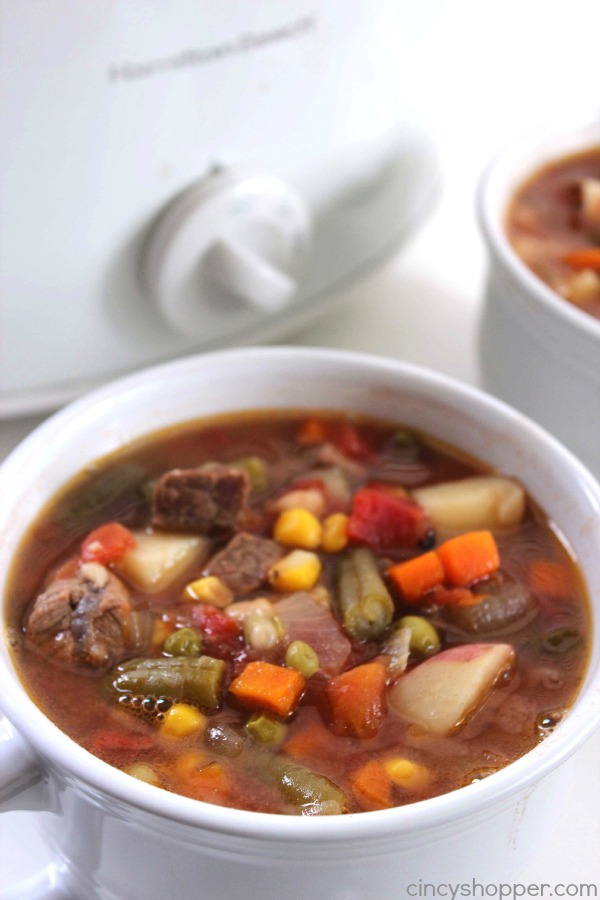
Where is `reflection of handle`? Image resolution: width=600 pixels, height=900 pixels. reflection of handle is located at coordinates tap(88, 839).